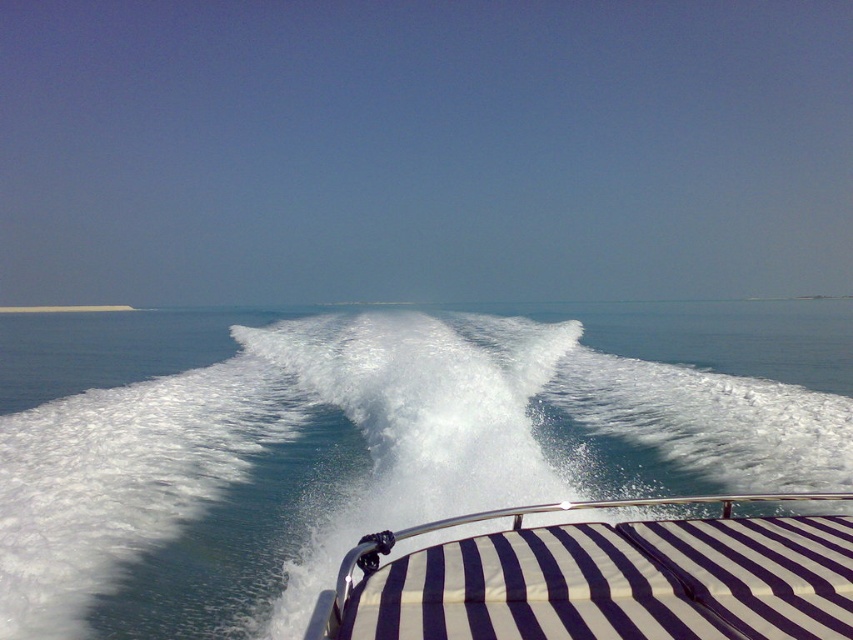
Does white foamy water at center have a lesser width compared to white striped fabric at center?

No, white foamy water at center is not thinner than white striped fabric at center.

Can you confirm if white foamy water at center is wider than white striped fabric at center?

Yes, white foamy water at center is wider than white striped fabric at center.

Locate an element on the screen. The height and width of the screenshot is (640, 853). white foamy water at center is located at coordinates (369, 440).